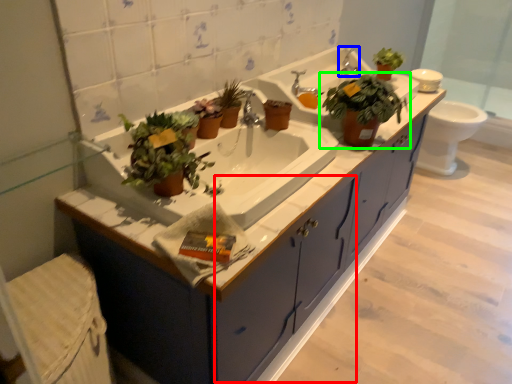
Question: Estimate the real-world distances between objects in this image. Which object is closer to drawer (highlighted by a red box), faucet (highlighted by a blue box) or houseplant (highlighted by a green box)?

Choices:
 (A) faucet
 (B) houseplant

Answer: (B)